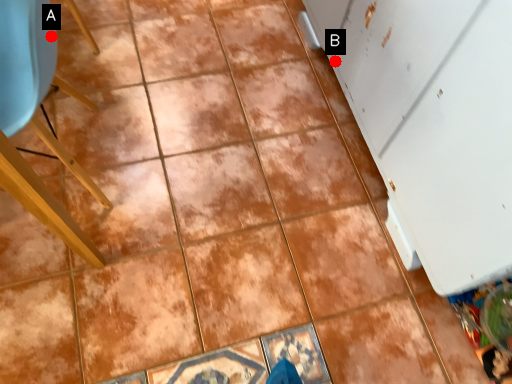
Question: Two points are circled on the image, labeled by A and B beside each circle. Which of the following is the closest to the observer?

Choices:
 (A) A is closer
 (B) B is closer

Answer: (A)